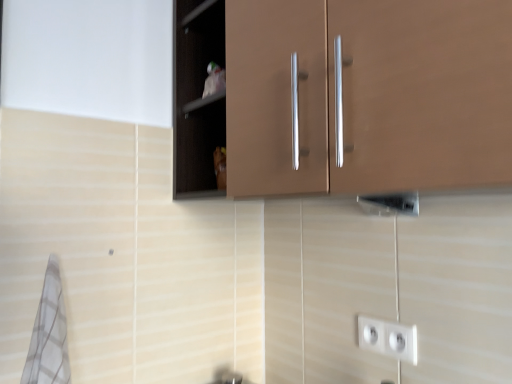
Question: From the image's perspective, is matte brown cabinet at upper center, the 1th cabinetry viewed from the front, located beneath white checkered bath towel at lower left?

Choices:
 (A) yes
 (B) no

Answer: (B)

Question: Considering the relative sizes of matte brown cabinet at upper center, the 1th cabinetry viewed from the front, and white checkered bath towel at lower left in the image provided, is matte brown cabinet at upper center, the 1th cabinetry viewed from the front, smaller than white checkered bath towel at lower left?

Choices:
 (A) yes
 (B) no

Answer: (B)

Question: Is matte brown cabinet at upper center, arranged as the second cabinetry when viewed from the back, at the right side of white checkered bath towel at lower left?

Choices:
 (A) no
 (B) yes

Answer: (B)

Question: Is matte brown cabinet at upper center, arranged as the second cabinetry when viewed from the back, far from white checkered bath towel at lower left?

Choices:
 (A) no
 (B) yes

Answer: (A)

Question: Is matte brown cabinet at upper center, the 1th cabinetry viewed from the front, positioned behind white checkered bath towel at lower left?

Choices:
 (A) no
 (B) yes

Answer: (A)

Question: Which is correct: matte brown cabinet at upper center, the 1th cabinetry viewed from the front, is inside white checkered bath towel at lower left, or outside of it?

Choices:
 (A) outside
 (B) inside

Answer: (A)

Question: Is matte brown cabinet at upper center, the 1th cabinetry viewed from the front, to the left or to the right of white checkered bath towel at lower left in the image?

Choices:
 (A) right
 (B) left

Answer: (A)

Question: From the image's perspective, is matte brown cabinet at upper center, the 1th cabinetry viewed from the front, positioned above or below white checkered bath towel at lower left?

Choices:
 (A) above
 (B) below

Answer: (A)

Question: Is matte brown cabinet at upper center, arranged as the second cabinetry when viewed from the back, wider or thinner than white checkered bath towel at lower left?

Choices:
 (A) wide
 (B) thin

Answer: (A)

Question: From a real-world perspective, is white plastic socket at lower right positioned above or below matte brown cabinet at upper center, arranged as the second cabinetry when viewed from the back?

Choices:
 (A) below
 (B) above

Answer: (A)

Question: Looking at their shapes, would you say white plastic socket at lower right is wider or thinner than matte brown cabinet at upper center, the 1th cabinetry viewed from the front?

Choices:
 (A) thin
 (B) wide

Answer: (A)

Question: Is white plastic socket at lower right situated inside matte brown cabinet at upper center, the 1th cabinetry viewed from the front, or outside?

Choices:
 (A) inside
 (B) outside

Answer: (B)

Question: In the image, is white plastic socket at lower right positioned in front of or behind matte brown cabinet at upper center, the 1th cabinetry viewed from the front?

Choices:
 (A) front
 (B) behind

Answer: (B)

Question: From their relative heights in the image, would you say white plastic socket at lower right is taller or shorter than brown matte cabinet at center, the 2th cabinetry from the front?

Choices:
 (A) tall
 (B) short

Answer: (B)

Question: Considering the relative positions of white plastic socket at lower right and brown matte cabinet at center, the 2th cabinetry from the front, in the image provided, is white plastic socket at lower right to the left or to the right of brown matte cabinet at center, the 2th cabinetry from the front,?

Choices:
 (A) left
 (B) right

Answer: (B)